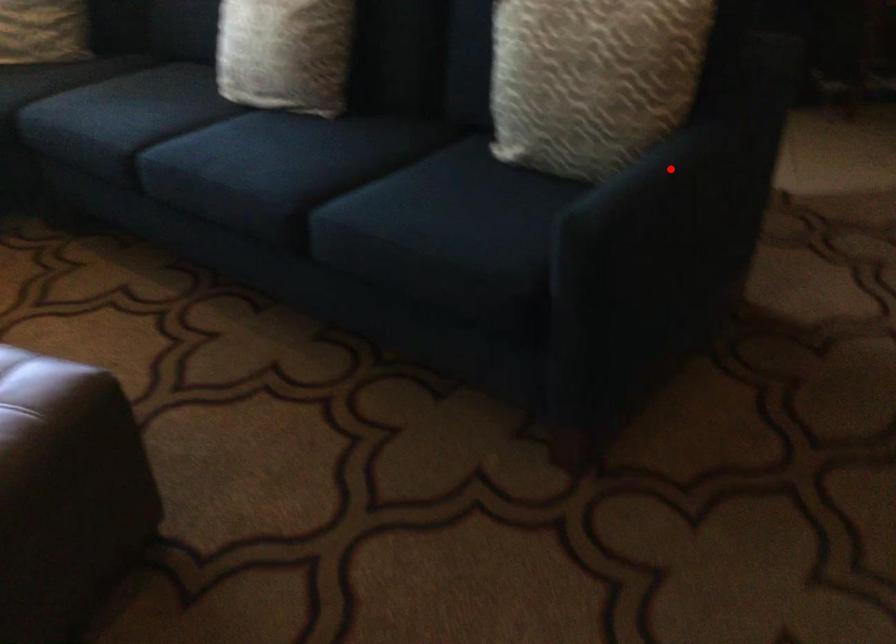
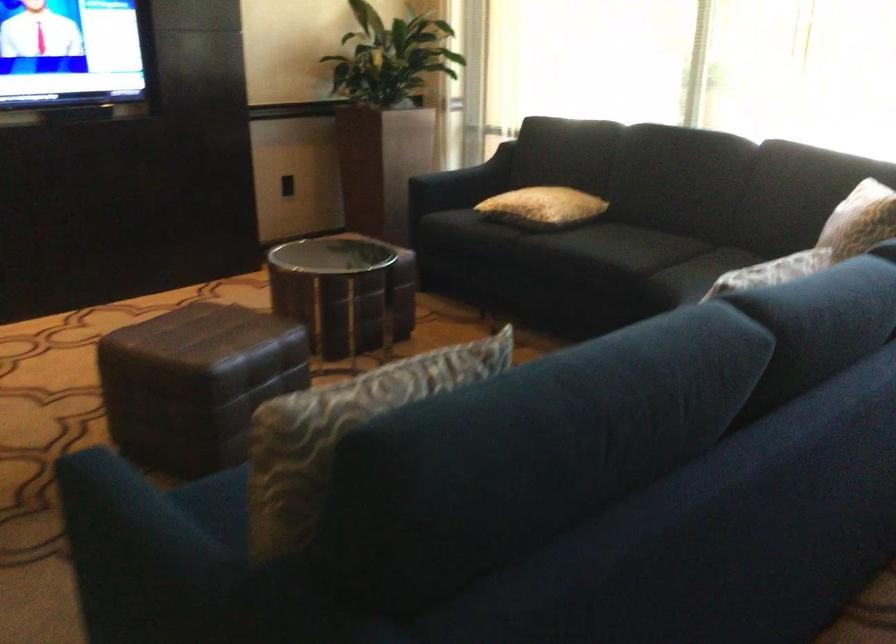
Find the pixel in the second image that matches the highlighted location in the first image.

(134, 534)